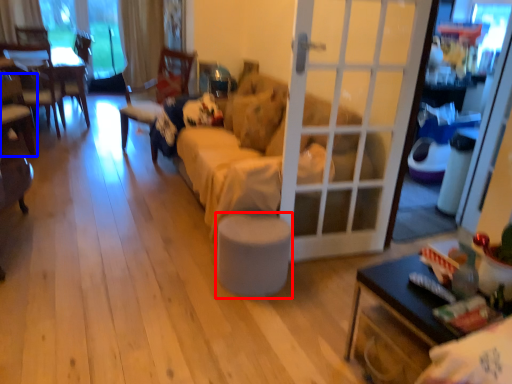
Question: Which point is closer to the camera, stool (highlighted by a red box) or chair (highlighted by a blue box)?

Choices:
 (A) stool
 (B) chair

Answer: (A)